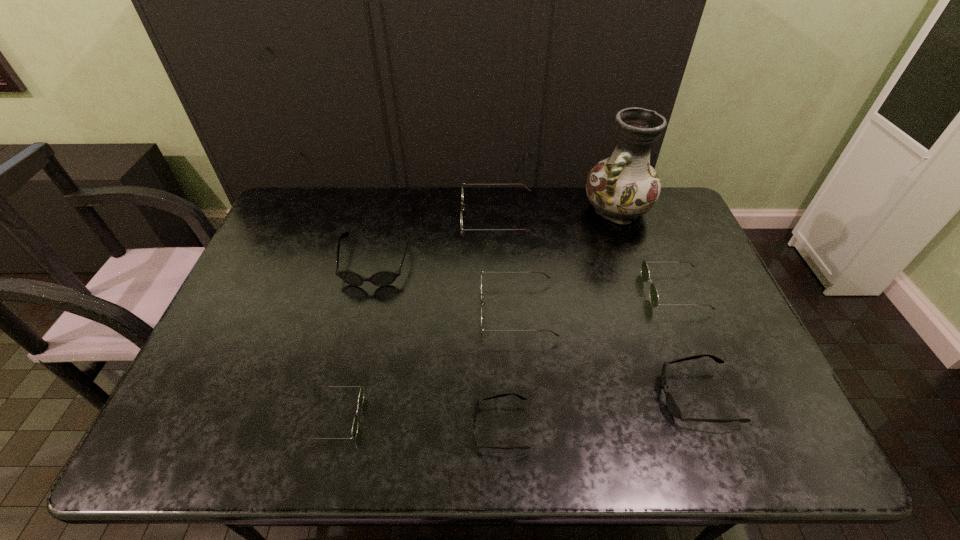
The image size is (960, 540). What are the coordinates of `vacant region that satisfies the following two spatial constraints: 1. on the front side of the tallest object; 2. on the front-facing side of the biggest green sunglasses` in the screenshot? It's located at (620, 218).

This screenshot has width=960, height=540. I want to click on free space that satisfies the following two spatial constraints: 1. on the lenses of the leftmost black sunglasses; 2. on the front-facing side of the smallest green sunglasses, so click(339, 417).

Image resolution: width=960 pixels, height=540 pixels. What are the coordinates of `vacant area that satisfies the following two spatial constraints: 1. on the front side of the tallest object; 2. on the front-facing side of the third smallest green sunglasses` in the screenshot? It's located at (653, 310).